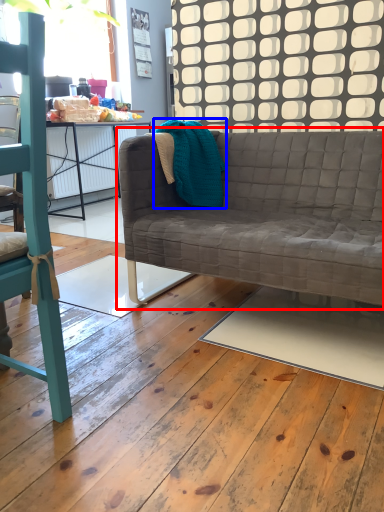
Question: Which object is closer to the camera taking this photo, studio couch (highlighted by a red box) or material (highlighted by a blue box)?

Choices:
 (A) studio couch
 (B) material

Answer: (A)